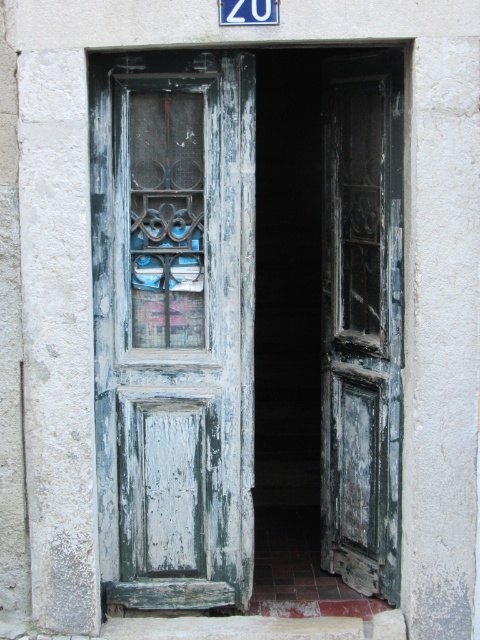
Is point (189, 292) farther from camera compared to point (349, 152)?

No, (189, 292) is in front of (349, 152).

Is point (95, 179) positioned behind point (345, 97)?

No, it is in front of (345, 97).

Where is `weathered teal wood door at center`? This screenshot has width=480, height=640. weathered teal wood door at center is located at coordinates (173, 324).

Which is in front, point (109, 520) or point (252, 20)?

Point (252, 20)

From the picture: Who is shorter, weathered teal wood door at center or white plastic sign at upper center?

With less height is white plastic sign at upper center.

You are a GUI agent. You are given a task and a screenshot of the screen. Output one action in this format:
    pyautogui.click(x=<x>, y=<y>)
    Task: Click on the weathered teal wood door at center
    The width and height of the screenshot is (480, 640).
    Given the screenshot: What is the action you would take?
    pyautogui.click(x=173, y=324)

At what (x,y) coordinates should I click in order to perform the action: click on weathered teal wood door at center. Please return your answer as a coordinate pair (x, y). Looking at the image, I should click on (173, 324).

Which of these two, distressed green wood door at center or white plastic sign at upper center, stands shorter?

Standing shorter between the two is white plastic sign at upper center.

Who is taller, distressed green wood door at center or white plastic sign at upper center?

Standing taller between the two is distressed green wood door at center.

Is point (388, 566) closer to viewer compared to point (260, 17)?

No, it is not.

Find the location of a particular element. The width and height of the screenshot is (480, 640). distressed green wood door at center is located at coordinates (361, 321).